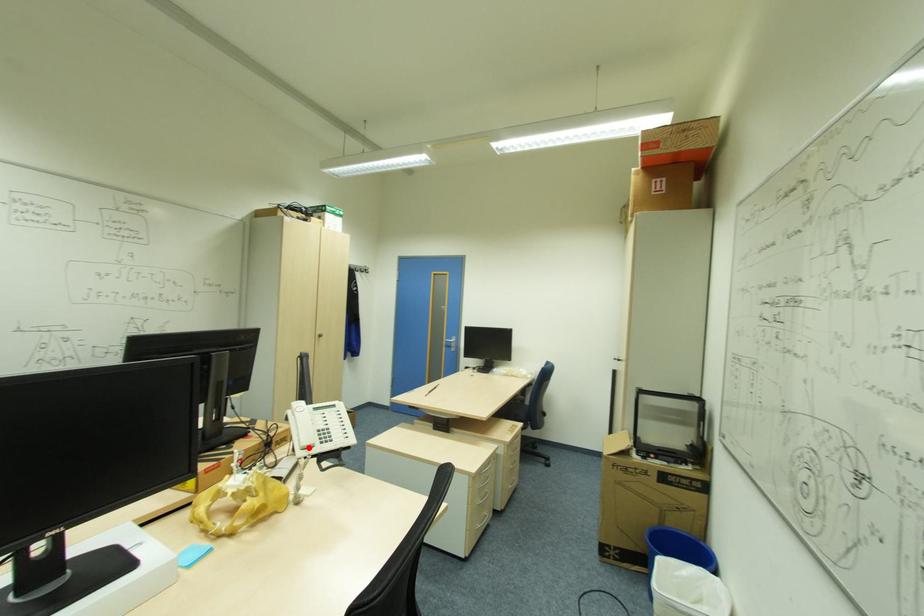
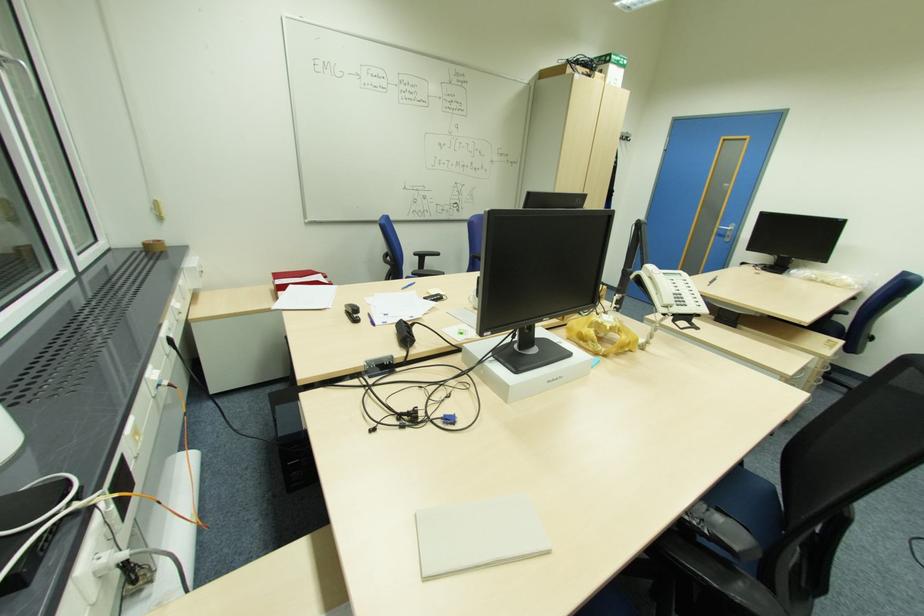
In the second image, find the point that corresponds to the highlighted location in the first image.

(670, 306)